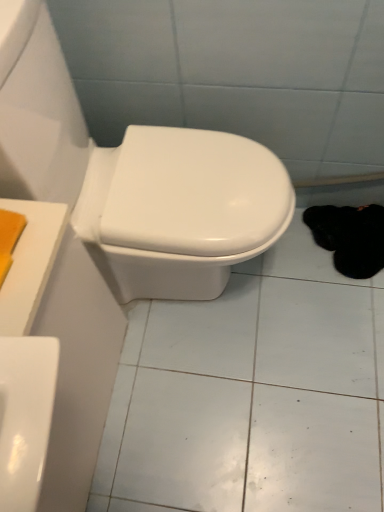
In order to face white glossy toilet at center, should I rotate leftwards or rightwards?

A 5.949 degree turn to the left will do.

Where is `white glossy toilet at center`? This screenshot has height=512, width=384. white glossy toilet at center is located at coordinates (134, 177).

Describe the element at coordinates (134, 177) in the screenshot. I see `white glossy toilet at center` at that location.

Locate an element on the screen. The height and width of the screenshot is (512, 384). white glossy toilet at center is located at coordinates (134, 177).